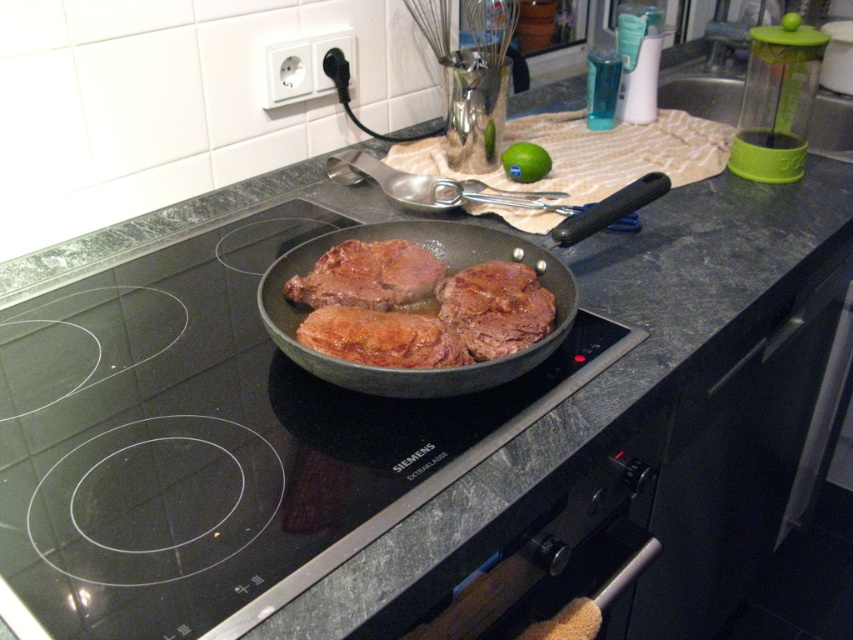
Question: Which point is closer to the camera?

Choices:
 (A) (419, 237)
 (B) (369, 323)

Answer: (B)

Question: Which of the following is the closest to the observer?

Choices:
 (A) brown crispy meat at center
 (B) shiny black frying pan at center

Answer: (B)

Question: Can you confirm if brown matte meat at center is wider than brown crispy meat at center?

Choices:
 (A) yes
 (B) no

Answer: (B)

Question: Does brown matte meat at center have a larger size compared to green matte lime at upper center?

Choices:
 (A) yes
 (B) no

Answer: (A)

Question: Which point appears closest to the camera in this image?

Choices:
 (A) (508, 339)
 (B) (335, 269)

Answer: (A)

Question: Does shiny black frying pan at center have a smaller size compared to brown glossy steak at center?

Choices:
 (A) no
 (B) yes

Answer: (A)